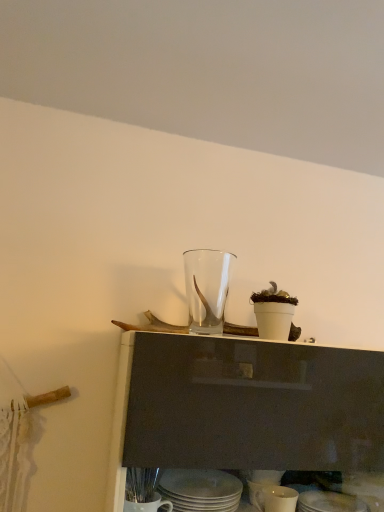
Question: Would you consider matte white plate at lower center, which ranks as the fourth tableware in top-to-bottom order, to be distant from white ceramic plates at lower center, which appears as the second tableware when viewed from the top?

Choices:
 (A) yes
 (B) no

Answer: (B)

Question: Does matte white plate at lower center, which appears as the first tableware when ordered from the bottom, contain white ceramic plates at lower center, arranged as the third tableware when ordered from the bottom?

Choices:
 (A) yes
 (B) no

Answer: (B)

Question: Considering the relative positions of matte white plate at lower center, which appears as the first tableware when ordered from the bottom, and white ceramic plates at lower center, which appears as the second tableware when viewed from the top, in the image provided, is matte white plate at lower center, which appears as the first tableware when ordered from the bottom, in front of white ceramic plates at lower center, which appears as the second tableware when viewed from the top,?

Choices:
 (A) no
 (B) yes

Answer: (A)

Question: Can you confirm if matte white plate at lower center, which ranks as the fourth tableware in top-to-bottom order, is wider than white ceramic plates at lower center, which appears as the second tableware when viewed from the top?

Choices:
 (A) no
 (B) yes

Answer: (A)

Question: Is matte white plate at lower center, which ranks as the fourth tableware in top-to-bottom order, taller than white ceramic plates at lower center, arranged as the third tableware when ordered from the bottom?

Choices:
 (A) no
 (B) yes

Answer: (B)

Question: Is matte white plate at lower center, which ranks as the fourth tableware in top-to-bottom order, smaller than white ceramic plates at lower center, arranged as the third tableware when ordered from the bottom?

Choices:
 (A) no
 (B) yes

Answer: (B)

Question: Is white ceramic plates at lower center, which appears as the second tableware when viewed from the top, to the left of matte white plate at lower center, which ranks as the fourth tableware in top-to-bottom order, from the viewer's perspective?

Choices:
 (A) yes
 (B) no

Answer: (A)

Question: Considering the relative positions of white ceramic plates at lower center, which appears as the second tableware when viewed from the top, and matte white plate at lower center, which appears as the first tableware when ordered from the bottom, in the image provided, is white ceramic plates at lower center, which appears as the second tableware when viewed from the top, behind matte white plate at lower center, which appears as the first tableware when ordered from the bottom,?

Choices:
 (A) no
 (B) yes

Answer: (A)

Question: Is the position of white ceramic plates at lower center, which appears as the second tableware when viewed from the top, less distant than that of matte white plate at lower center, which ranks as the fourth tableware in top-to-bottom order?

Choices:
 (A) no
 (B) yes

Answer: (B)

Question: Is white ceramic plates at lower center, arranged as the third tableware when ordered from the bottom, far away from matte white plate at lower center, which appears as the first tableware when ordered from the bottom?

Choices:
 (A) no
 (B) yes

Answer: (A)

Question: Could matte white plate at lower center, which appears as the first tableware when ordered from the bottom, be considered to be inside white ceramic plates at lower center, which appears as the second tableware when viewed from the top?

Choices:
 (A) no
 (B) yes

Answer: (A)

Question: Considering the relative positions of white ceramic plates at lower center, arranged as the third tableware when ordered from the bottom, and matte white plate at lower center, which appears as the first tableware when ordered from the bottom, in the image provided, is white ceramic plates at lower center, arranged as the third tableware when ordered from the bottom, to the right of matte white plate at lower center, which appears as the first tableware when ordered from the bottom, from the viewer's perspective?

Choices:
 (A) no
 (B) yes

Answer: (A)

Question: Is white ceramic plates at lower center, which appears as the second tableware when viewed from the top, taller than transparent glass vase at center, arranged as the 1th tableware when viewed from the top?

Choices:
 (A) no
 (B) yes

Answer: (A)